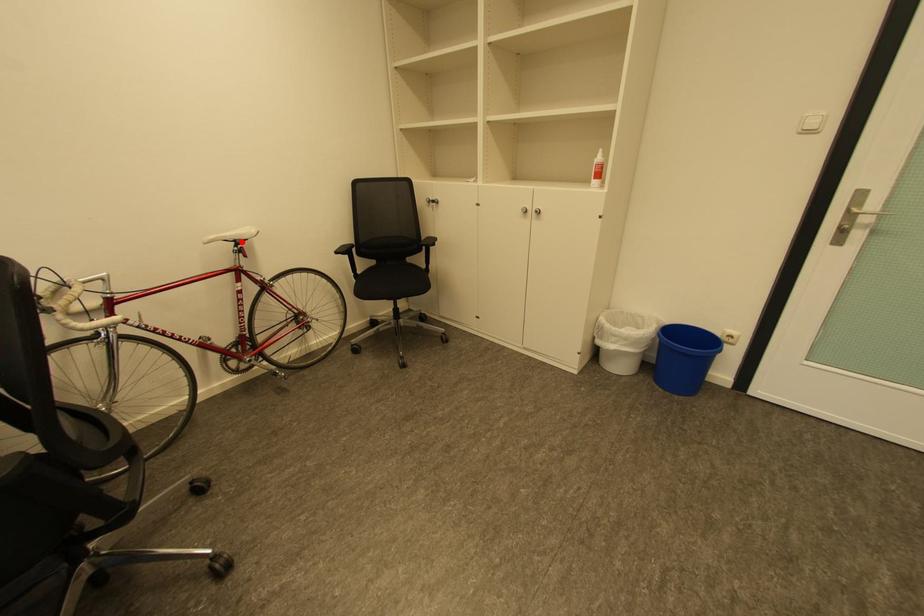
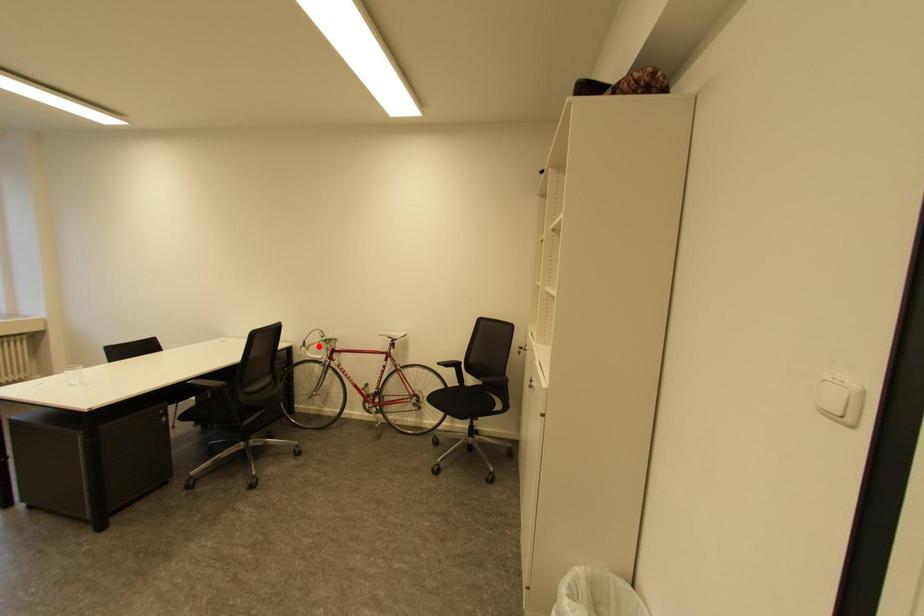
I am providing you with two images of the same scene from different viewpoints. A red point is marked on the first image and another point is marked on the second image. Are the points marked in image1 and image2 representing the same 3D position?

No